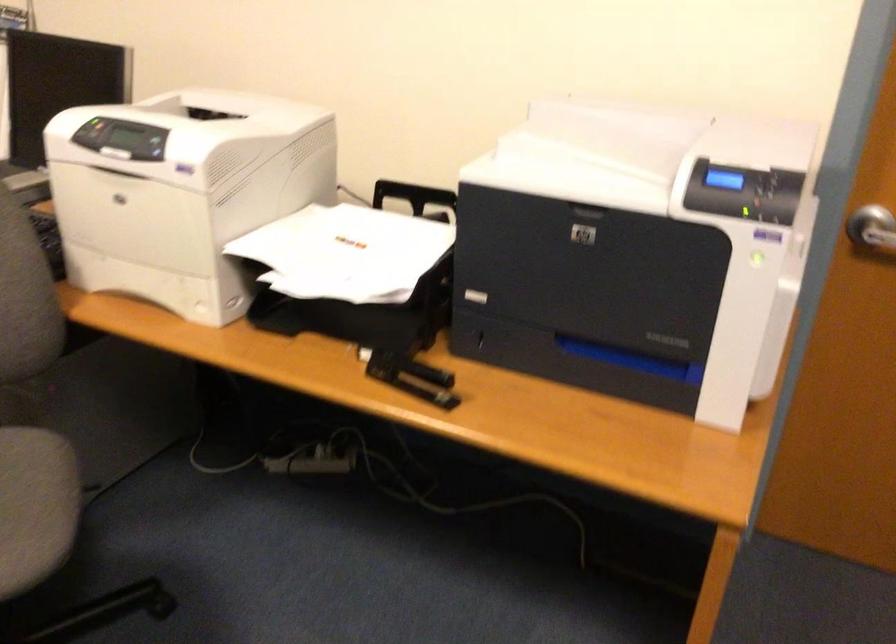
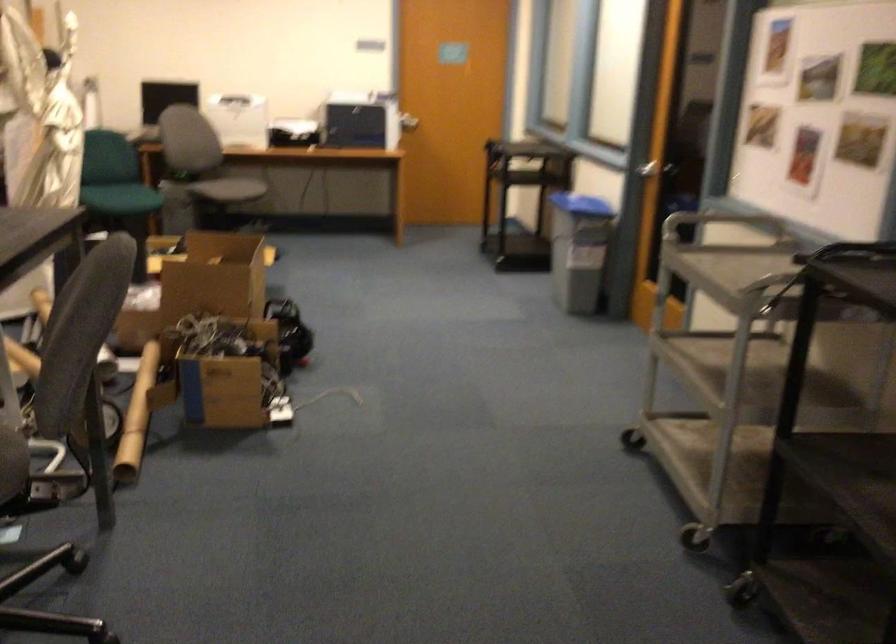
Question: I am providing you with two images of the same scene from different viewpoints. After the viewpoint changes to image2, which objects are now occluded?

Choices:
 (A) teal tissue box
 (B) silver door handle
 (C) printer control buttons
 (D) black cart handle

Answer: (C)